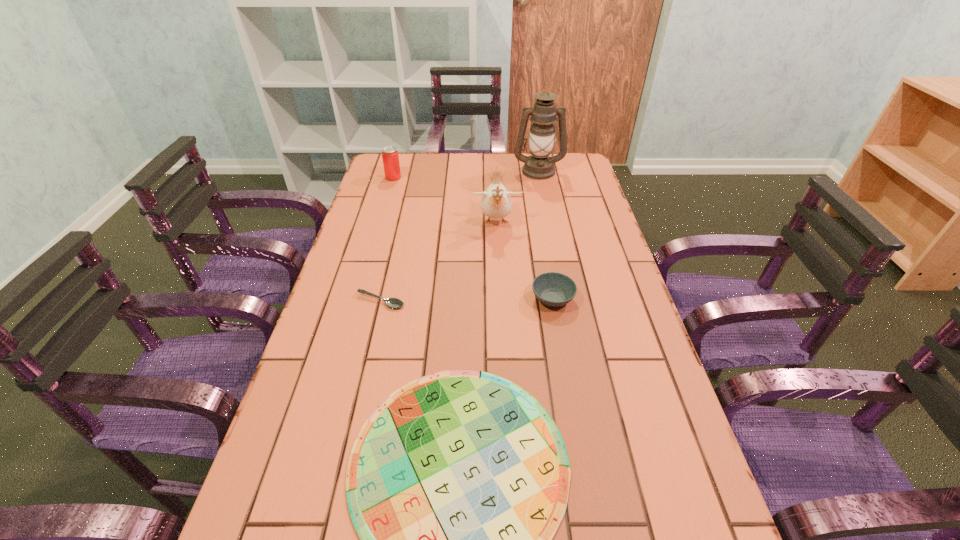
You are a GUI agent. You are given a task and a screenshot of the screen. Output one action in this format:
    pyautogui.click(x=<x>, y=<y>)
    Task: Click on the oil lamp
    This screenshot has width=960, height=540.
    Given the screenshot: What is the action you would take?
    pyautogui.click(x=538, y=165)

This screenshot has height=540, width=960. In order to click on the third farthest object in this screenshot , I will do `click(496, 203)`.

You are a GUI agent. You are given a task and a screenshot of the screen. Output one action in this format:
    pyautogui.click(x=<x>, y=<y>)
    Task: Click on the bird
    This screenshot has height=540, width=960.
    Given the screenshot: What is the action you would take?
    pyautogui.click(x=496, y=203)

Where is `the third tallest object`? This screenshot has height=540, width=960. the third tallest object is located at coordinates (390, 157).

Locate an element on the screen. This screenshot has height=540, width=960. soup bowl is located at coordinates (553, 289).

Image resolution: width=960 pixels, height=540 pixels. In order to click on the second shortest object in this screenshot , I will do `click(390, 302)`.

Where is `vacant space positioned 0.220m on the left of the tallest object`? This screenshot has width=960, height=540. vacant space positioned 0.220m on the left of the tallest object is located at coordinates (455, 171).

The height and width of the screenshot is (540, 960). In order to click on vacant region located at the beak of the third farthest object in this screenshot , I will do `click(499, 295)`.

At what (x,y) coordinates should I click in order to perform the action: click on vacant space located 0.290m on the front of the can. Please return your answer as a coordinate pair (x, y). This screenshot has width=960, height=540. Looking at the image, I should click on (378, 228).

Locate an element on the screen. free spot located 0.360m on the left of the third shortest object is located at coordinates (394, 299).